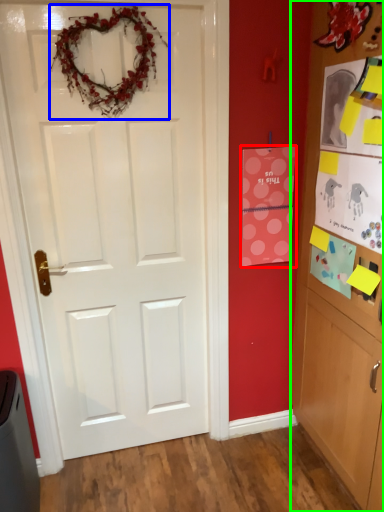
Question: Considering the real-world distances, which object is closest to postcard (highlighted by a red box)? christmas decoration (highlighted by a blue box) or cabinetry (highlighted by a green box).

Choices:
 (A) christmas decoration
 (B) cabinetry

Answer: (B)